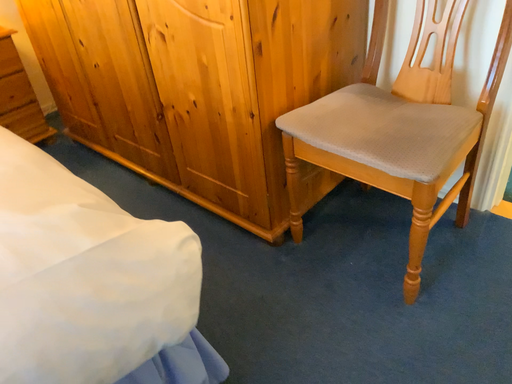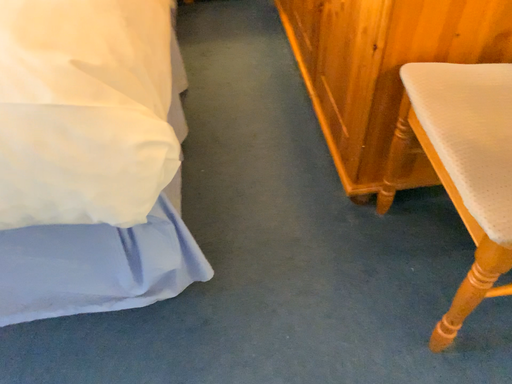
Question: How did the camera likely rotate when shooting the video?

Choices:
 (A) rotated upward
 (B) rotated downward

Answer: (B)